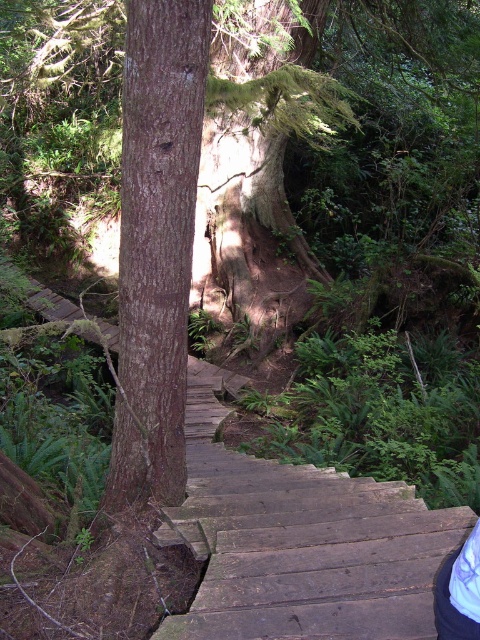
Question: Does wooden stairs at center appear on the right side of brown rough bark tree at center?

Choices:
 (A) no
 (B) yes

Answer: (B)

Question: Which object appears closest to the camera in this image?

Choices:
 (A) wooden stairs at center
 (B) brown rough bark tree at center

Answer: (B)

Question: Can you confirm if wooden stairs at center is bigger than brown rough bark tree at center?

Choices:
 (A) yes
 (B) no

Answer: (B)

Question: Is wooden stairs at center bigger than brown rough bark tree at center?

Choices:
 (A) yes
 (B) no

Answer: (B)

Question: Among these objects, which one is nearest to the camera?

Choices:
 (A) wooden stairs at center
 (B) brown rough bark tree at center

Answer: (B)